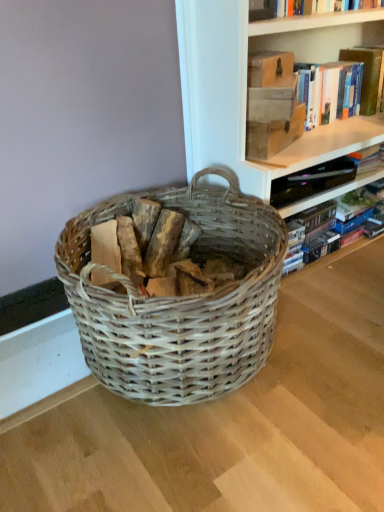
Question: Looking at their shapes, would you say matte brown book at upper right, the 1th paperback book when ordered from bottom to top, is wider or thinner than hardcover book at upper right, which is the 2th book from top to bottom?

Choices:
 (A) thin
 (B) wide

Answer: (A)

Question: Based on their sizes in the image, would you say matte brown book at upper right, the 1th paperback book when ordered from bottom to top, is bigger or smaller than hardcover book at upper right, placed as the first book when sorted from bottom to top?

Choices:
 (A) small
 (B) big

Answer: (A)

Question: Considering the real-world distances, which object is closest to the wooden logs at center?

Choices:
 (A) hardcover book at upper right, which is the 1th book from top to bottom
 (B) woven wood basket at center
 (C) matte brown book at upper right, the 1th paperback book when ordered from bottom to top
 (D) hardcover book at upper right, which is the 2th book from top to bottom
 (E) matte brown book at upper center, acting as the 1th paperback book starting from the top

Answer: (B)

Question: Which is farther from the wooden logs at center?

Choices:
 (A) hardcover book at upper right, which is the 2th book from top to bottom
 (B) matte brown book at upper right, the 1th paperback book when ordered from bottom to top
 (C) hardcover book at upper right, which is the 1th book from top to bottom
 (D) matte brown book at upper center, the second paperback book from the bottom
 (E) woven wood basket at center

Answer: (C)